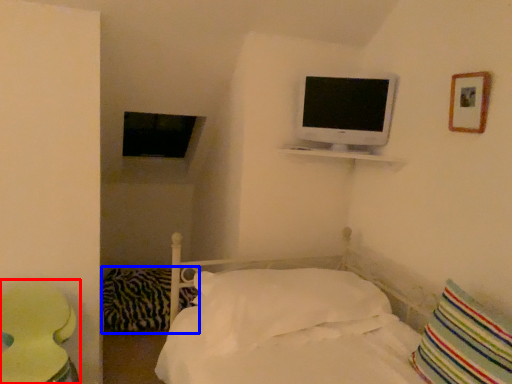
Question: Which of the following is the closest to the observer, round table (highlighted by a red box) or pillow (highlighted by a blue box)?

Choices:
 (A) round table
 (B) pillow

Answer: (A)